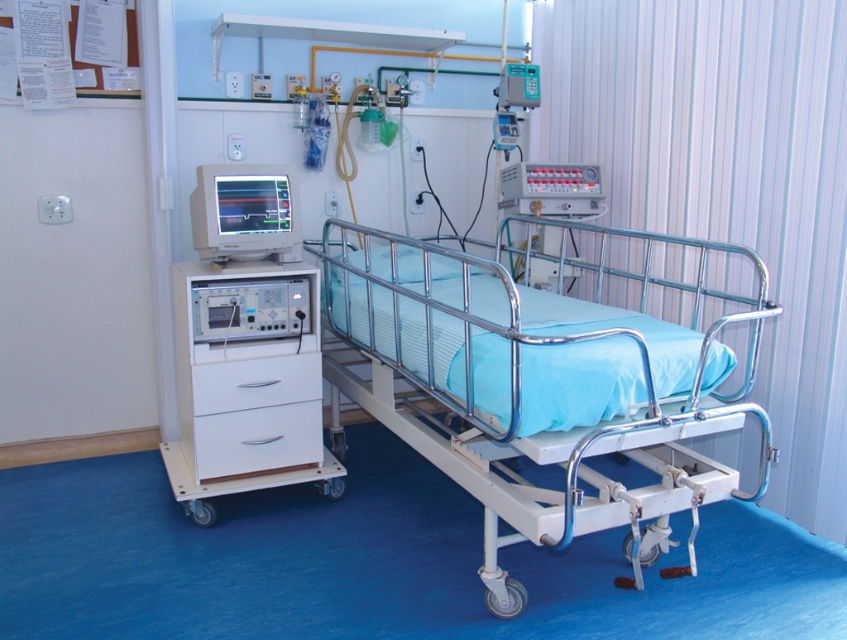
Question: Among these objects, which one is farthest from the camera?

Choices:
 (A) white matte drawer at center
 (B) matte silver monitor at center-left

Answer: (A)

Question: Is matte silver monitor at center-left closer to the viewer compared to white matte drawer at center?

Choices:
 (A) no
 (B) yes

Answer: (B)

Question: Which of these objects is positioned farthest from the metallic blue bed at center?

Choices:
 (A) matte silver monitor at center-left
 (B) white matte drawer at center
 (C) white glossy drawer at lower left

Answer: (C)

Question: Which of these objects is positioned farthest from the white matte drawer at center?

Choices:
 (A) white glossy drawer at lower left
 (B) matte silver monitor at center-left

Answer: (B)

Question: Is white glossy drawer at lower left in front of white matte drawer at center?

Choices:
 (A) yes
 (B) no

Answer: (B)

Question: Is matte silver monitor at center-left closer to the viewer compared to white glossy drawer at lower left?

Choices:
 (A) yes
 (B) no

Answer: (A)